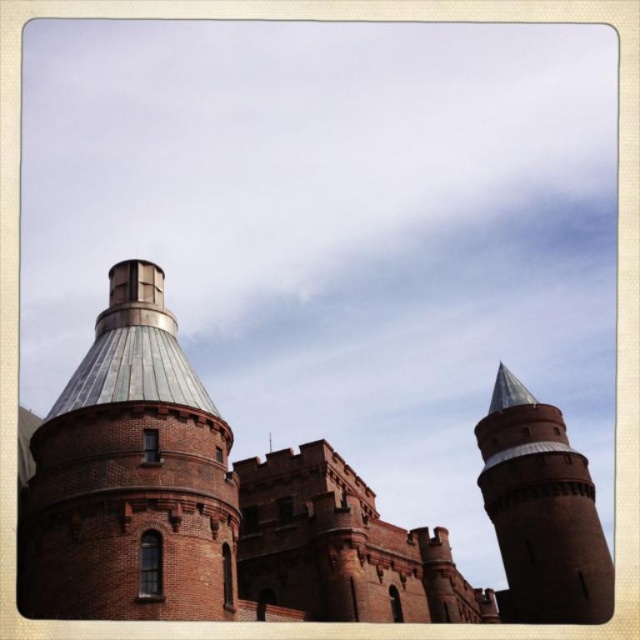
You are an architect planning to add a new decorative element to the red brick castle at center and the brick tower at upper right. Since you want them to look balanced, which structure should you make the decorative element smaller on?

The decorative element should be smaller on the brick tower at upper right because the red brick castle at center is wider, so a smaller decoration would maintain balance between the two structures.

You are an architect examining the historic building. You need to install a new decorative light above the shiny metallic dome at center. Based on the building layout, where should you position the light relative to the dome?

The shiny metallic dome at center is located at point (131, 477), so the light should be positioned directly above this coordinate to ensure proper placement.